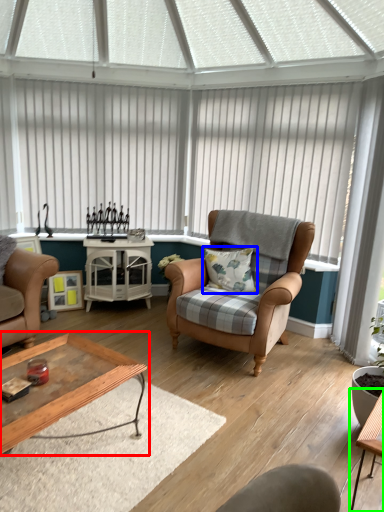
Question: Considering the real-world distances, which object is closest to coffee table (highlighted by a red box)? pillow (highlighted by a blue box) or table (highlighted by a green box).

Choices:
 (A) pillow
 (B) table

Answer: (B)